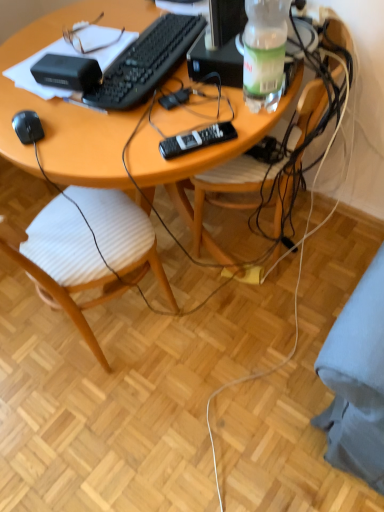
This screenshot has width=384, height=512. Find the location of `blank space to the left of wooden chair at center, the first chair from the right`. blank space to the left of wooden chair at center, the first chair from the right is located at coordinates (182, 247).